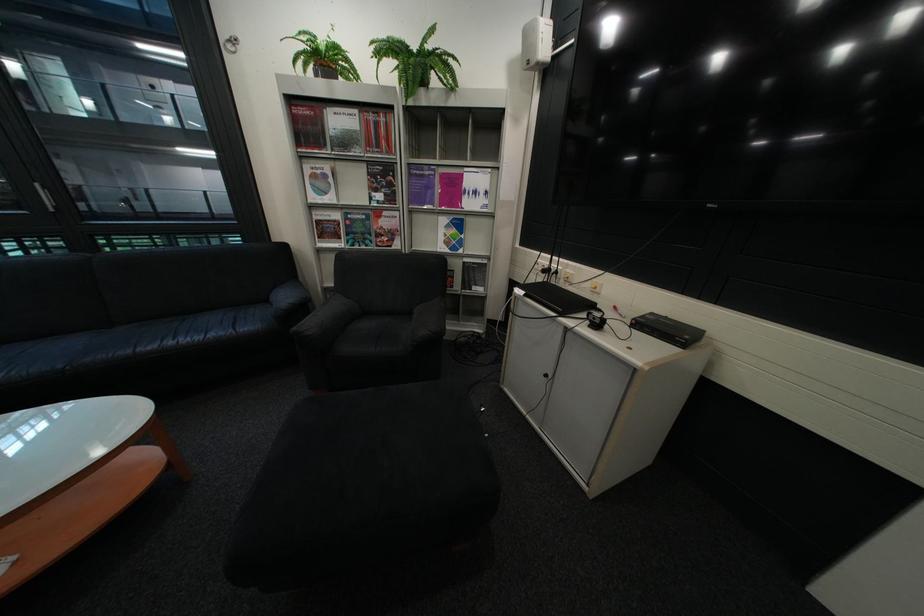
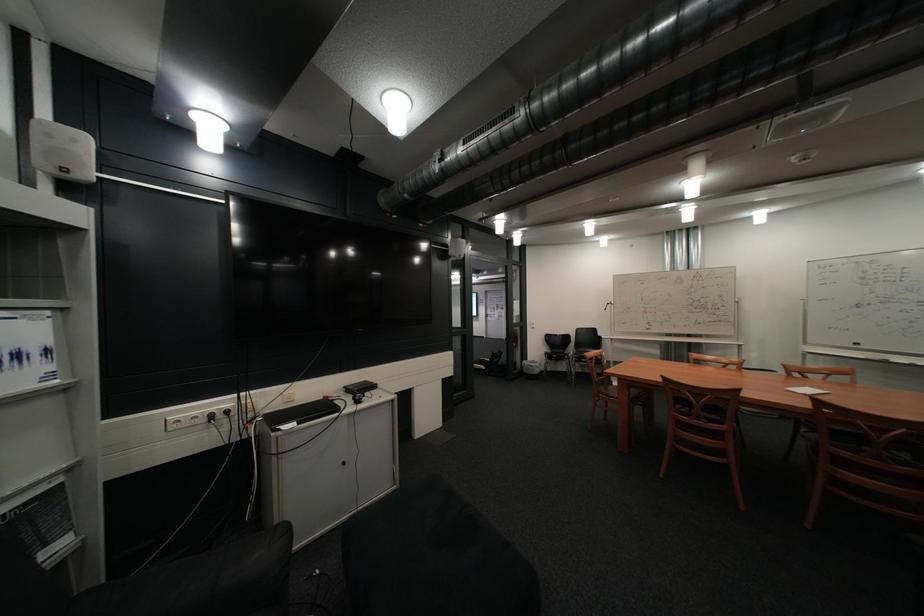
Find the pixel in the second image that matches (492,209) in the first image.

(46, 386)